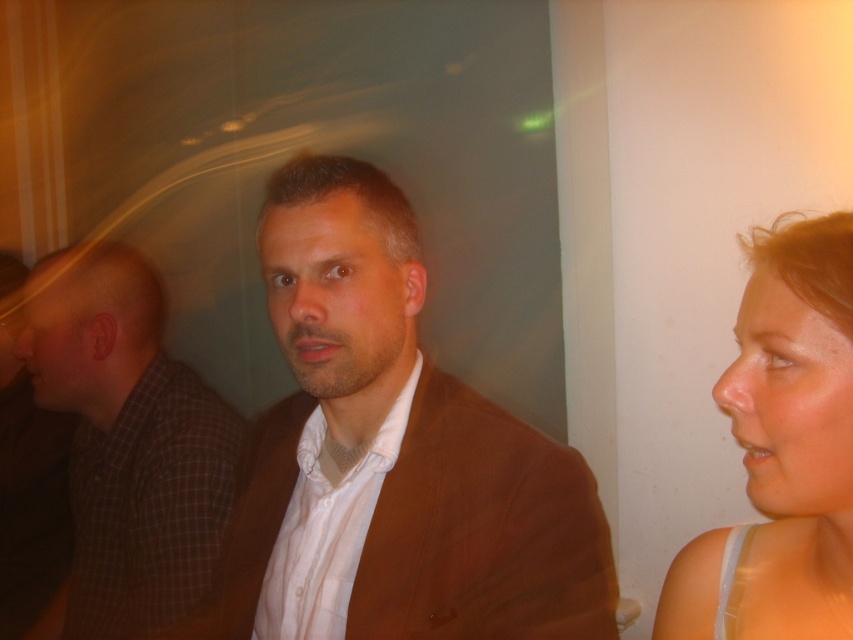
Question: Based on their relative distances, which object is nearer to the brown checkered shirt at left?

Choices:
 (A) brown fabric jacket at center
 (B) smooth skin face at right

Answer: (A)

Question: Can you confirm if brown fabric jacket at center is positioned below smooth skin face at right?

Choices:
 (A) no
 (B) yes

Answer: (B)

Question: Which object is the closest to the brown checkered shirt at left?

Choices:
 (A) smooth skin face at right
 (B) brown fabric jacket at center

Answer: (B)

Question: Which point is farther from the camera taking this photo?

Choices:
 (A) (25, 346)
 (B) (770, 573)

Answer: (A)

Question: Where is brown checkered shirt at left located in relation to smooth skin face at right in the image?

Choices:
 (A) above
 (B) below

Answer: (B)

Question: Is brown fabric jacket at center thinner than brown checkered shirt at left?

Choices:
 (A) yes
 (B) no

Answer: (B)